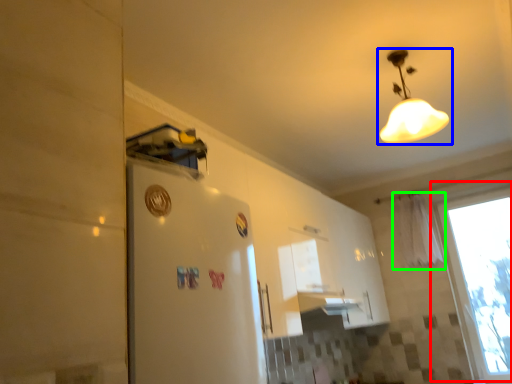
Question: Which object is the farthest from window (highlighted by a red box)? Choose among these: lamp (highlighted by a blue box) or curtain (highlighted by a green box).

Choices:
 (A) lamp
 (B) curtain

Answer: (A)